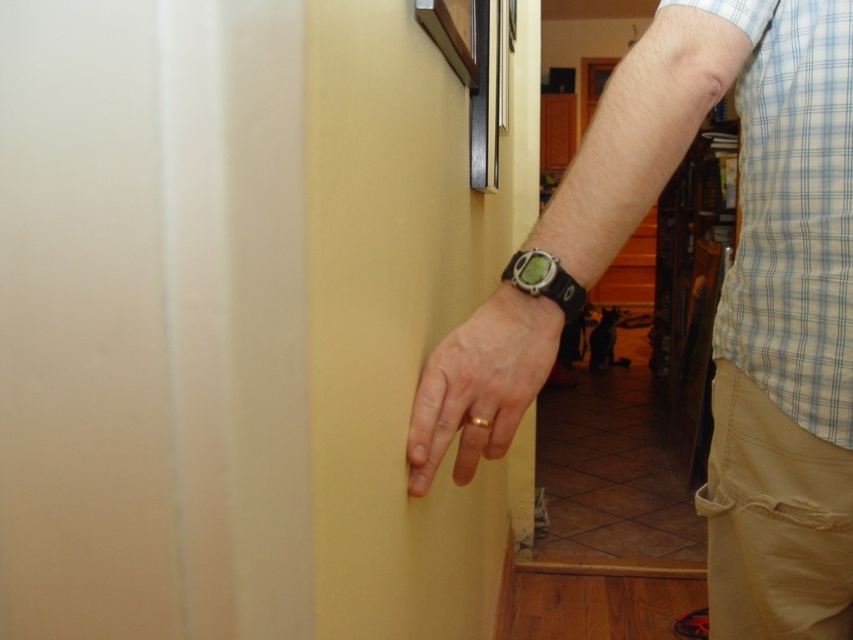
You are a delivery person trying to locate the yellow matte door at center and the black rubber watch at center in the image. Which object is closer to you?

The yellow matte door at center is closer to you than the black rubber watch at center because it is in front of it.

You are a delivery person holding a large package that is 12 inches wide. You need to pass through the yellow matte door at center. Can you fit through the doorway?

The distance between the yellow matte door at center and the person is 11.38 inches. Since your package is 12 inches wide, it is slightly wider than the available space, so you cannot fit through the doorway.